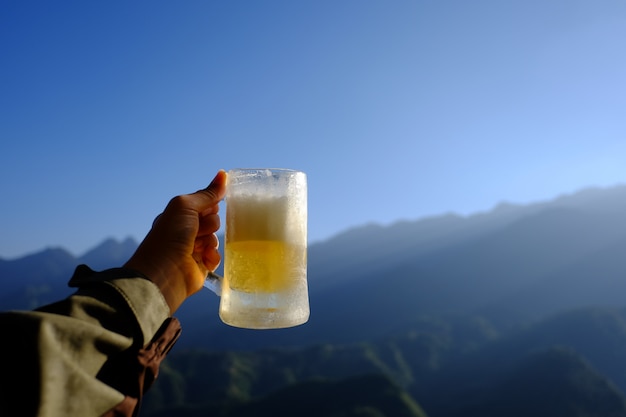
This screenshot has width=626, height=417. Identify the location of mug handle. (205, 277).